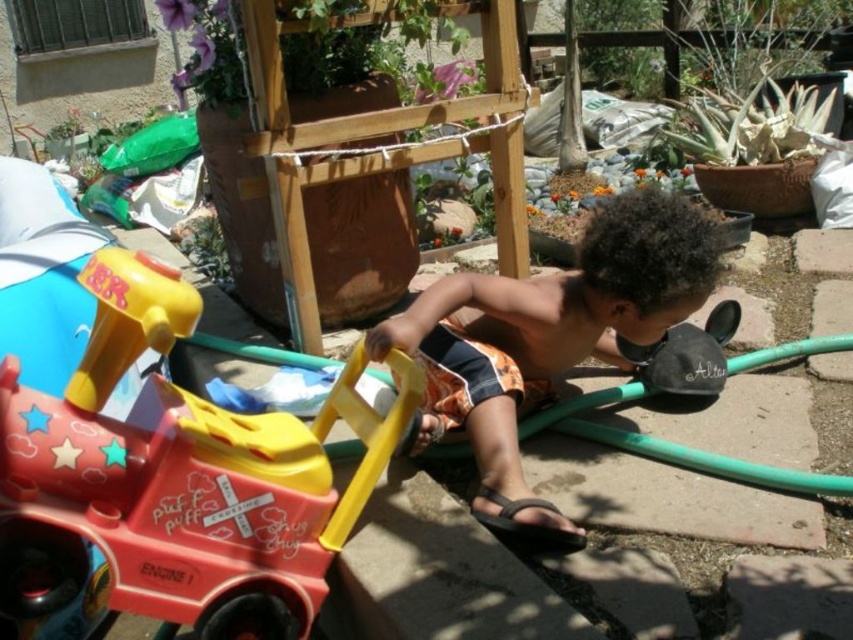
Who is more distant from viewer, (107, 518) or (540, 520)?

The point (540, 520) is behind.

Consider the image. Is matte plastic train at lower left wider than brown textured shorts at center?

No, matte plastic train at lower left is not wider than brown textured shorts at center.

This screenshot has width=853, height=640. Find the location of `matte plastic train at lower left`. matte plastic train at lower left is located at coordinates (175, 477).

I want to click on matte plastic train at lower left, so click(x=175, y=477).